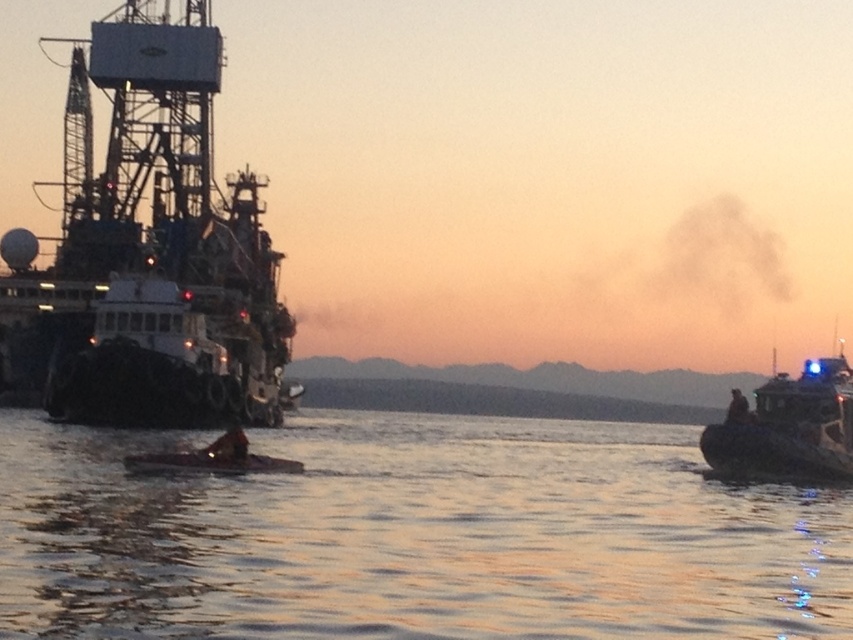
Question: Which point appears closest to the camera in this image?

Choices:
 (A) (117, 586)
 (B) (741, 394)
 (C) (770, 385)

Answer: (A)

Question: Considering the real-world distances, which object is farthest from the white plastic boat at right?

Choices:
 (A) dark blue uniform at center
 (B) brown matte boat at center
 (C) white matte ship at left

Answer: (C)

Question: From the image, what is the correct spatial relationship of white matte ship at left in relation to dark blue uniform at center?

Choices:
 (A) right
 (B) left

Answer: (B)

Question: Which object is positioned closest to the smooth water at center?

Choices:
 (A) brown matte boat at center
 (B) white matte ship at left
 (C) white plastic boat at right

Answer: (A)

Question: Does smooth water at center have a smaller size compared to dark blue uniform at center?

Choices:
 (A) yes
 (B) no

Answer: (B)

Question: Can you confirm if smooth water at center is thinner than white matte ship at left?

Choices:
 (A) yes
 (B) no

Answer: (B)